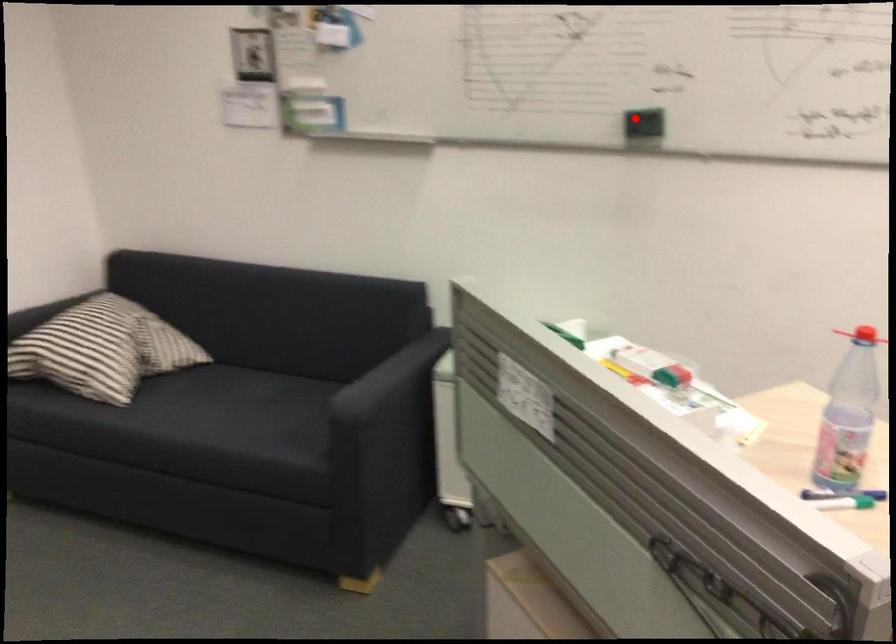
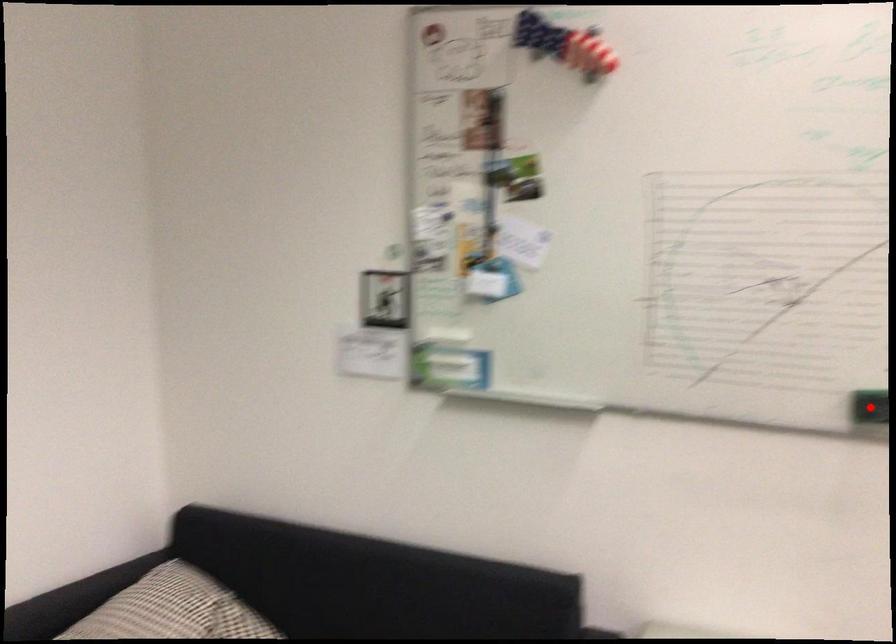
I am providing you with two images of the same scene from different viewpoints. A red point is marked on the first image and another point is marked on the second image. Is the red point in image1 aligned with the point shown in image2?

Yes